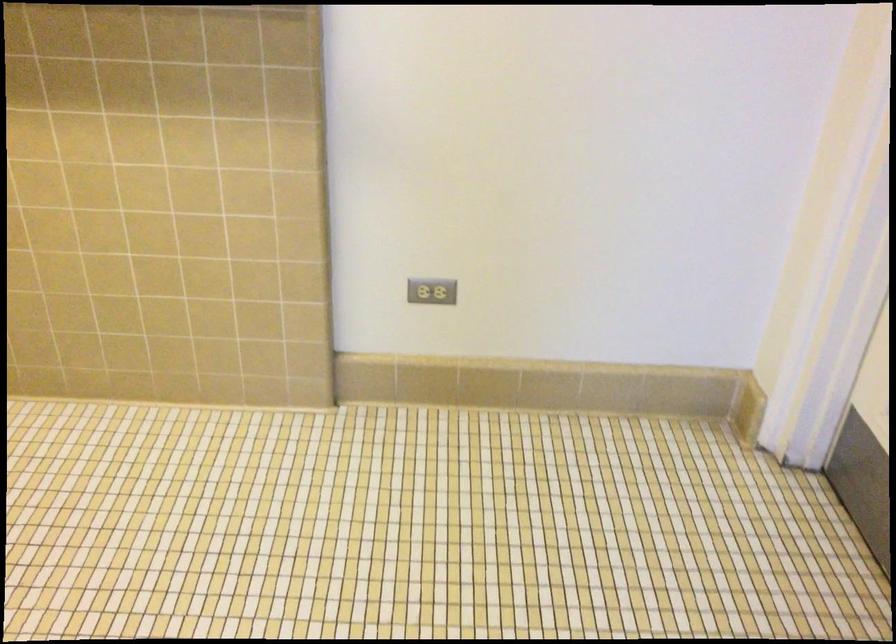
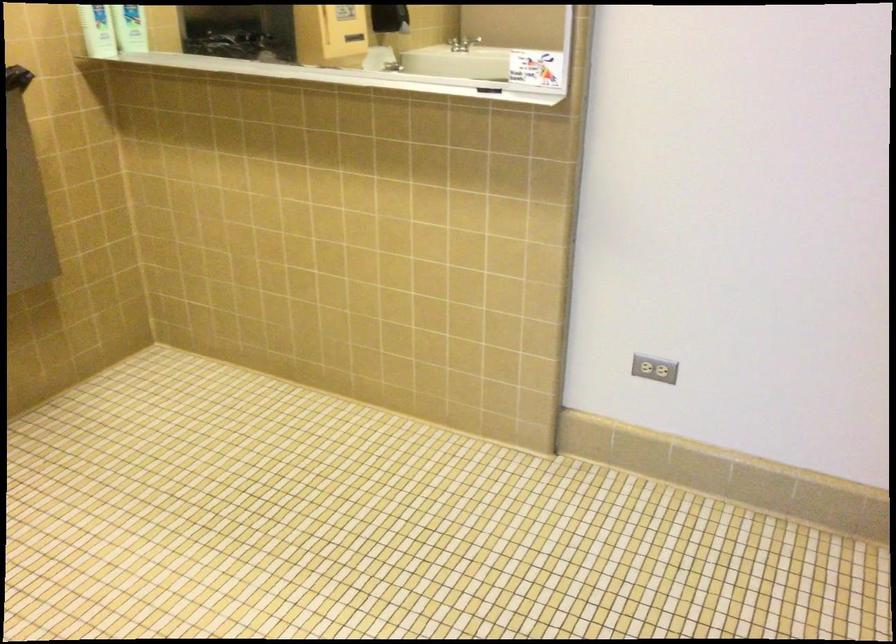
Question: The camera is either moving clockwise (left) or counter-clockwise (right) around the object. The first image is from the beginning of the video and the second image is from the end. Is the camera moving left or right when shooting the video?

Choices:
 (A) Left
 (B) Right

Answer: (B)